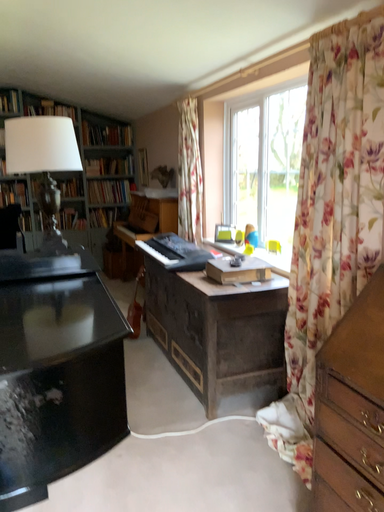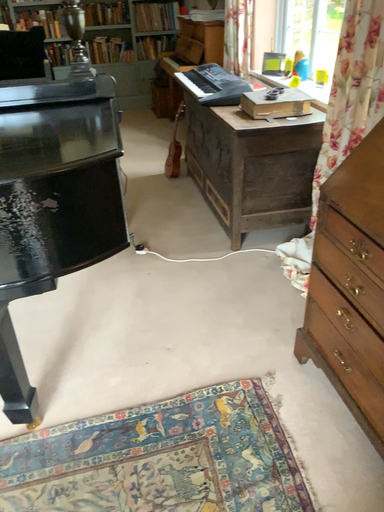
Question: How did the camera likely rotate when shooting the video?

Choices:
 (A) rotated right
 (B) rotated left

Answer: (B)